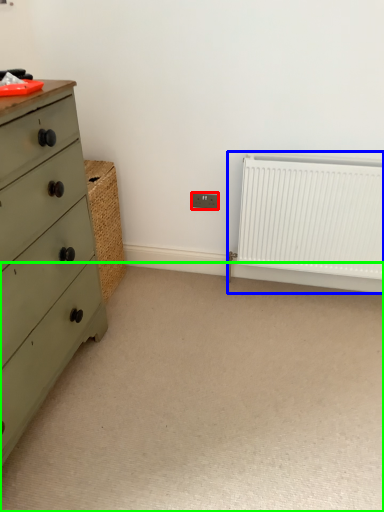
Question: Estimate the real-world distances between objects in this image. Which object is closer to electric outlet (highlighted by a red box), radiator (highlighted by a blue box) or plain (highlighted by a green box)?

Choices:
 (A) radiator
 (B) plain

Answer: (A)